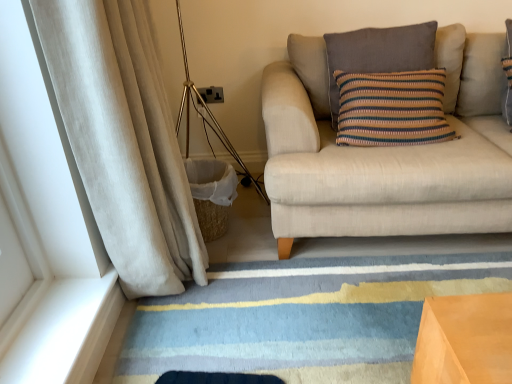
Question: From the image's perspective, is knitted cotton pillow at upper right located beneath beige corduroy curtain at left?

Choices:
 (A) no
 (B) yes

Answer: (A)

Question: Are knitted cotton pillow at upper right and beige corduroy curtain at left located far from each other?

Choices:
 (A) yes
 (B) no

Answer: (B)

Question: Considering the relative sizes of knitted cotton pillow at upper right and beige corduroy curtain at left in the image provided, is knitted cotton pillow at upper right taller than beige corduroy curtain at left?

Choices:
 (A) yes
 (B) no

Answer: (B)

Question: From a real-world perspective, is knitted cotton pillow at upper right positioned over beige corduroy curtain at left based on gravity?

Choices:
 (A) no
 (B) yes

Answer: (B)

Question: Does knitted cotton pillow at upper right turn towards beige corduroy curtain at left?

Choices:
 (A) no
 (B) yes

Answer: (A)

Question: Is beige corduroy curtain at left situated inside beige fabric couch at right or outside?

Choices:
 (A) outside
 (B) inside

Answer: (A)

Question: Considering the positions of beige corduroy curtain at left and beige fabric couch at right in the image, is beige corduroy curtain at left wider or thinner than beige fabric couch at right?

Choices:
 (A) wide
 (B) thin

Answer: (B)

Question: In the image, is beige corduroy curtain at left positioned in front of or behind beige fabric couch at right?

Choices:
 (A) behind
 (B) front

Answer: (B)

Question: Does point (125, 31) appear closer or farther from the camera than point (461, 223)?

Choices:
 (A) closer
 (B) farther

Answer: (A)

Question: From the image's perspective, is gold metallic tripod lamp at left positioned above or below beige corduroy curtain at left?

Choices:
 (A) below
 (B) above

Answer: (B)

Question: Is point (206, 122) closer or farther from the camera than point (110, 132)?

Choices:
 (A) closer
 (B) farther

Answer: (B)

Question: Is gold metallic tripod lamp at left to the left or to the right of beige corduroy curtain at left in the image?

Choices:
 (A) left
 (B) right

Answer: (B)

Question: In terms of width, does gold metallic tripod lamp at left look wider or thinner when compared to beige corduroy curtain at left?

Choices:
 (A) wide
 (B) thin

Answer: (A)

Question: From the image's perspective, is knitted cotton pillow at upper right located above or below beige corduroy curtain at left?

Choices:
 (A) above
 (B) below

Answer: (A)

Question: In terms of height, does knitted cotton pillow at upper right look taller or shorter compared to beige corduroy curtain at left?

Choices:
 (A) short
 (B) tall

Answer: (A)